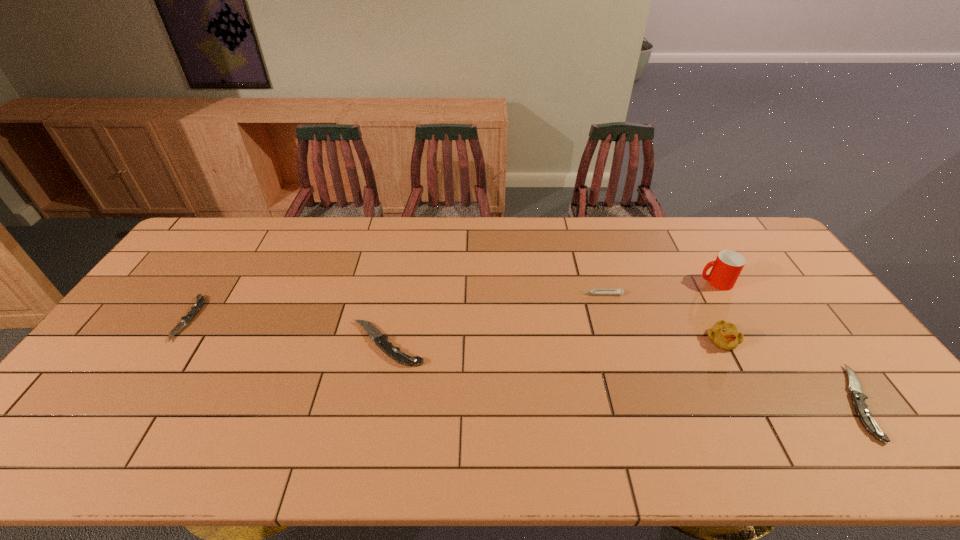
Locate an element on the screen. The height and width of the screenshot is (540, 960). free area in between the shortest pocketknife and the fifth shortest object is located at coordinates (455, 329).

Locate an element on the screen. The image size is (960, 540). free point between the second tallest object and the leftmost pocketknife is located at coordinates (455, 329).

Identify the location of empty space that is in between the second tallest pocketknife and the second object from left to right. pos(623,373).

Find the location of `free spot between the shortest pocketknife and the third object from left to right`. free spot between the shortest pocketknife and the third object from left to right is located at coordinates (394, 307).

The height and width of the screenshot is (540, 960). I want to click on object that stands as the third closest to the cup, so click(858, 398).

Find the location of a particular element. This screenshot has height=540, width=960. object that is the second closest to the second pocketknife from right to left is located at coordinates (199, 303).

Identify which pocketknife is the closest to the fifth object from right to left. Please provide its 2D coordinates. Your answer should be formatted as a tuple, i.e. [(x, y)], where the tuple contains the x and y coordinates of a point satisfying the conditions above.

[(199, 303)]

The image size is (960, 540). Identify the location of the third closest pocketknife relative to the fourth object from right to left. (199, 303).

Identify the location of free location that satisfies the following two spatial constraints: 1. on the front-facing side of the duckling; 2. on the right side of the second shortest pocketknife. The image size is (960, 540). (755, 402).